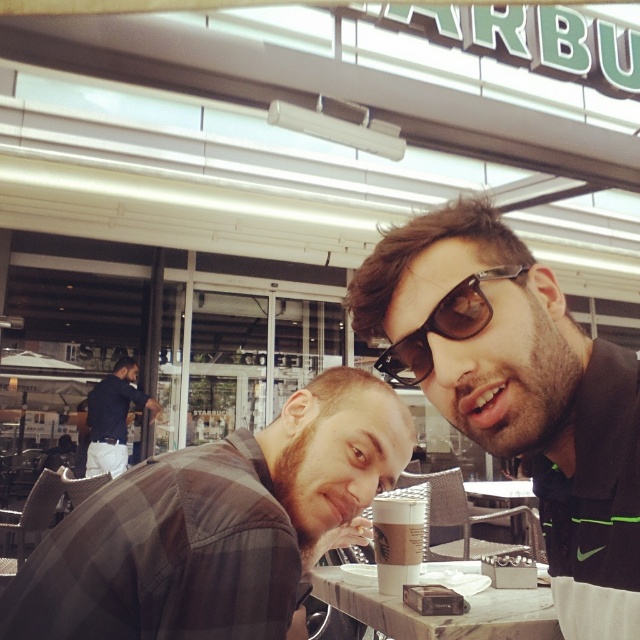
You are taking a photo of the two points in the image. Which point, point (220,589) or point (125,390), will appear larger in your photo?

Point (220,589) is closer to the camera than point (125,390), so it will appear larger in the photo.

You are a photographer taking a picture of the scene. You notice a point at coordinates (518,392). What object is located at this point?

The point at coordinates (518,392) is located on the sunglasses at center.